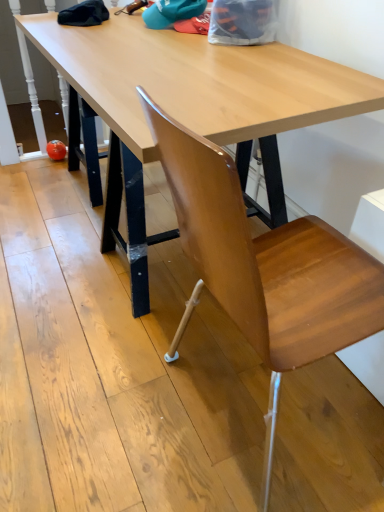
Measure the distance between wooden chair at center and camera.

A distance of 20.79 inches exists between wooden chair at center and camera.

What do you see at coordinates (264, 267) in the screenshot? I see `wooden chair at center` at bounding box center [264, 267].

At what (x,y) coordinates should I click in order to perform the action: click on wooden chair at center. Please return your answer as a coordinate pair (x, y). Looking at the image, I should click on tap(264, 267).

At what (x,y) coordinates should I click in order to perform the action: click on wooden chair at center. Please return your answer as a coordinate pair (x, y). Looking at the image, I should click on (264, 267).